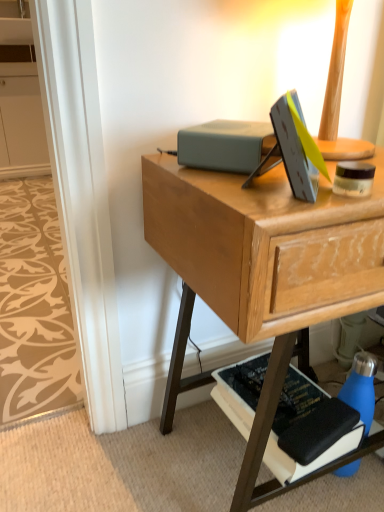
Identify the location of blank space situated above black matte book at lower right, which is the first paperback book in bottom-to-top order (from a real-world perspective). The width and height of the screenshot is (384, 512). (x=298, y=397).